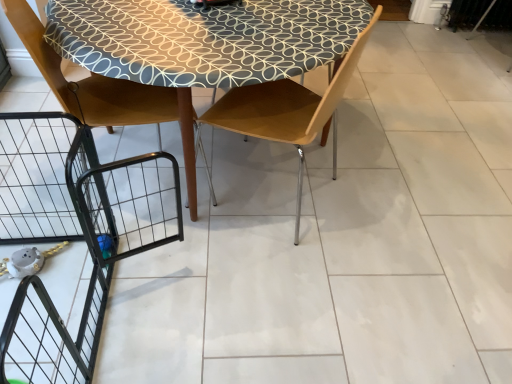
This screenshot has width=512, height=384. Find the location of `free point to the right of wooden chair at center, which is counted as the 1th chair, starting from the right`. free point to the right of wooden chair at center, which is counted as the 1th chair, starting from the right is located at coordinates (366, 196).